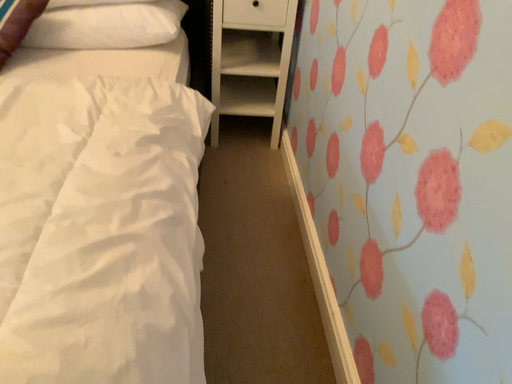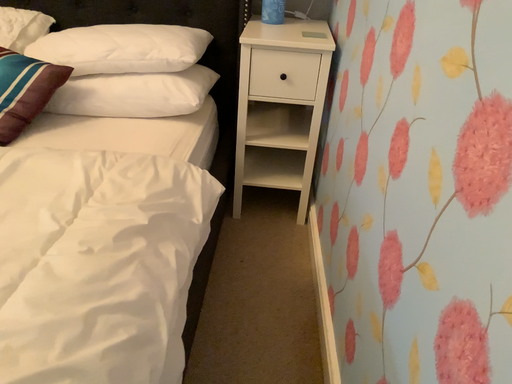
Question: Which way did the camera rotate in the video?

Choices:
 (A) rotated upward
 (B) rotated downward

Answer: (A)